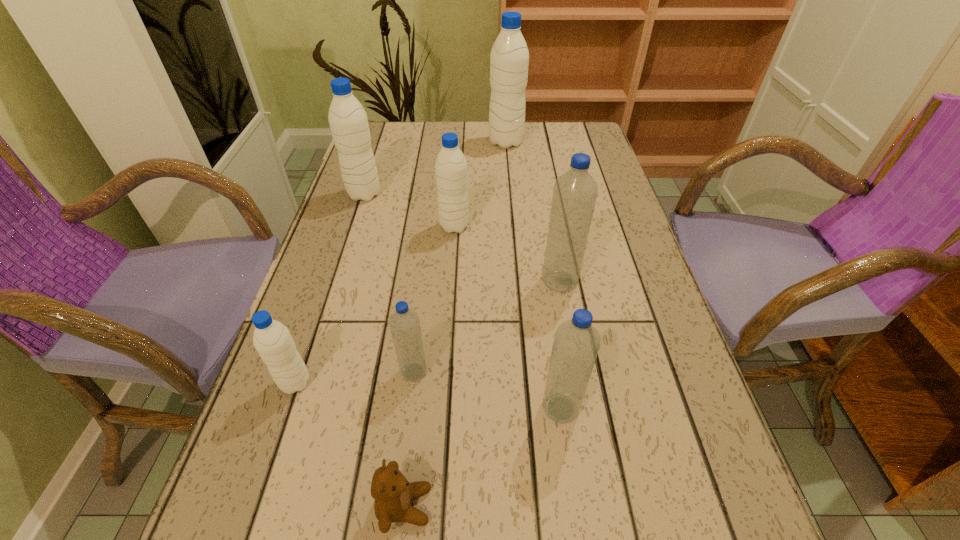
The image size is (960, 540). Find the location of `the smallest blue water bottle`. the smallest blue water bottle is located at coordinates (404, 323).

Locate an element on the screen. This screenshot has width=960, height=540. the smallest gray water bottle is located at coordinates (272, 340).

Where is `free space located 0.130m on the front of the farthest water bottle`? The image size is (960, 540). free space located 0.130m on the front of the farthest water bottle is located at coordinates (509, 174).

Find the location of a particular element. The height and width of the screenshot is (540, 960). blank area located on the back of the second farthest object is located at coordinates (374, 164).

This screenshot has width=960, height=540. What are the coordinates of `vacant area located 0.120m on the front of the fifth nearest object` in the screenshot? It's located at (570, 341).

Where is `free space located 0.320m on the right of the third gray water bottle from left to right`? The width and height of the screenshot is (960, 540). free space located 0.320m on the right of the third gray water bottle from left to right is located at coordinates (599, 226).

Find the location of a particular element. This screenshot has height=540, width=960. vacant region located on the left of the nearest blue water bottle is located at coordinates (327, 408).

The height and width of the screenshot is (540, 960). Identify the location of vacant space located on the left of the smallest blue water bottle. (345, 372).

In order to click on free point located 0.230m on the right of the nearest gray water bottle in this screenshot , I will do `click(442, 383)`.

Identify the location of object located at the far edge. (509, 59).